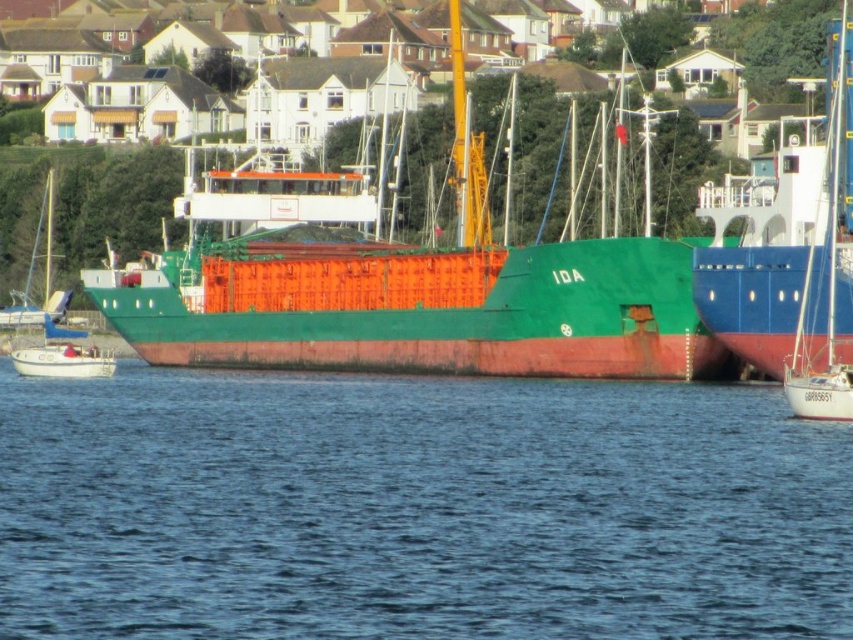
Is point (723, 340) farther from camera compared to point (848, 419)?

That is True.

Between point (785, 348) and point (817, 387), which one is positioned in front?

Point (817, 387) is more forward.

At what (x,y) coordinates should I click in order to perform the action: click on blue matte container ship at center. Please return your answer as a coordinate pair (x, y). Looking at the image, I should click on (788, 248).

Is green matte cargo ship at center wider than white sailboat at right?

Yes.

Is point (306, 307) more distant than point (837, 208)?

Yes, it is.

Between point (358, 339) and point (838, 368), which one is positioned in front?

Point (838, 368) is in front.

Image resolution: width=853 pixels, height=640 pixels. In order to click on green matte cargo ship at center in this screenshot , I will do `click(401, 285)`.

Is point (294, 340) farther from viewer compared to point (846, 257)?

Yes, it is behind point (846, 257).

Which is behind, point (590, 273) or point (849, 38)?

Positioned behind is point (590, 273).

The height and width of the screenshot is (640, 853). Find the location of `green matte cargo ship at center`. green matte cargo ship at center is located at coordinates (401, 285).